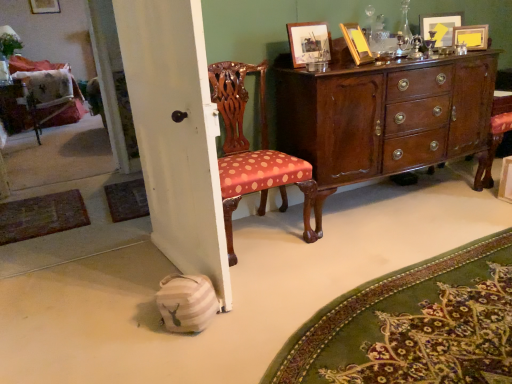
This screenshot has width=512, height=384. Find the location of `vacant region to the left of white painted wood door at lower left`. vacant region to the left of white painted wood door at lower left is located at coordinates (94, 287).